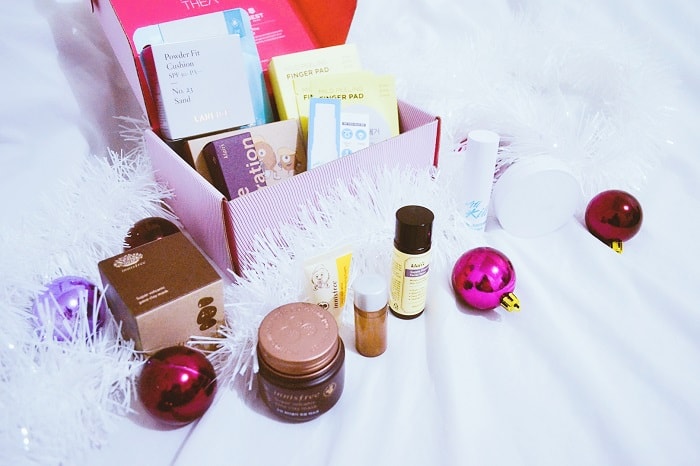
Where is `brown jar`? brown jar is located at coordinates (301, 398).